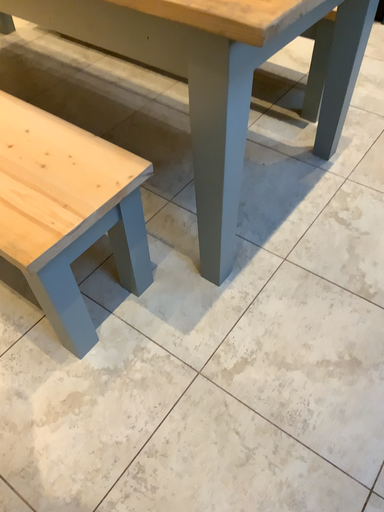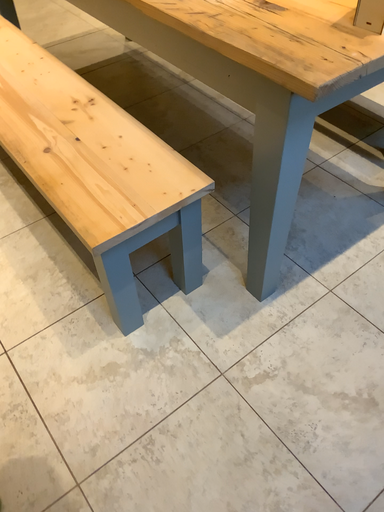
Question: Which way did the camera rotate in the video?

Choices:
 (A) rotated right
 (B) rotated left

Answer: (B)